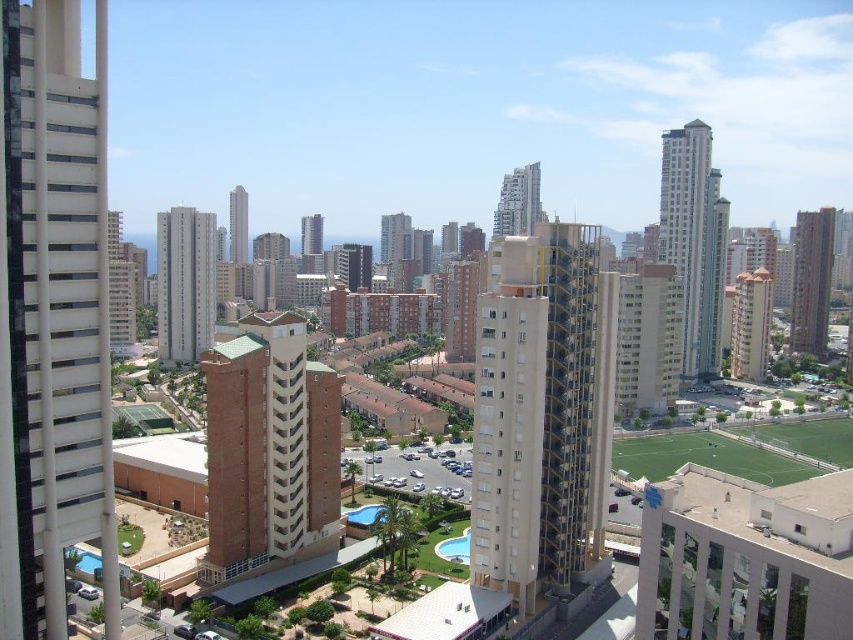
You are a city planner assessing the urban layout. You need to determine which structure occupies more space in the cityscape between the glassy teal skyscraper at right and the beige concrete building at center. Based on the scene, which one is larger?

The glassy teal skyscraper at right is bigger than the beige concrete building at center, so it occupies more space in the cityscape.

You are a city planner reviewing this urban layout. You need to determine if the light beige concrete building at center can be constructed without affecting the blue glass pool at lower left. Based on their positions, is this feasible?

The light beige concrete building at center is positioned over the blue glass pool at lower left, so constructing the building would interfere with the pool, making it infeasible to build without affecting the pool.

You are standing in the urban landscape and want to take a photo of both the glassy teal skyscraper at right and the smooth beige building at center. Which building should you focus on first to ensure both are in frame?

You should focus on the glassy teal skyscraper at right first because it is closer to the viewer than the smooth beige building at center, so adjusting the camera to include both would require framing starting from the closer one.